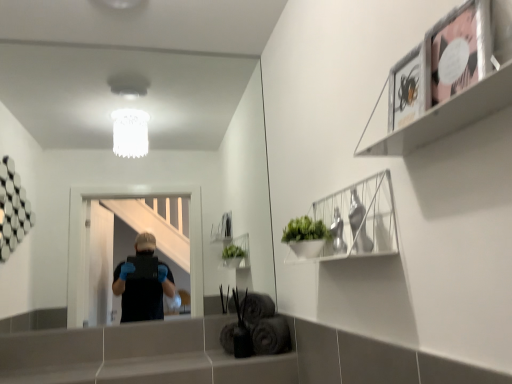
Question: Considering the relative positions of matte black picture frame at upper right and metallic silver frame at upper right in the image provided, is matte black picture frame at upper right in front of metallic silver frame at upper right?

Choices:
 (A) no
 (B) yes

Answer: (A)

Question: Could you tell me if matte black picture frame at upper right is facing metallic silver frame at upper right?

Choices:
 (A) no
 (B) yes

Answer: (B)

Question: Does matte black picture frame at upper right have a larger size compared to metallic silver frame at upper right?

Choices:
 (A) yes
 (B) no

Answer: (B)

Question: Can you confirm if matte black picture frame at upper right is smaller than metallic silver frame at upper right?

Choices:
 (A) yes
 (B) no

Answer: (A)

Question: Is the depth of matte black picture frame at upper right greater than that of metallic silver frame at upper right?

Choices:
 (A) no
 (B) yes

Answer: (B)

Question: From the image's perspective, is matte black picture frame at upper right above metallic silver frame at upper right?

Choices:
 (A) yes
 (B) no

Answer: (B)

Question: Considering the relative sizes of smooth gray ledge at lower center and metallic silver frame at upper right in the image provided, is smooth gray ledge at lower center thinner than metallic silver frame at upper right?

Choices:
 (A) yes
 (B) no

Answer: (B)

Question: Is smooth gray ledge at lower center positioned with its back to metallic silver frame at upper right?

Choices:
 (A) no
 (B) yes

Answer: (A)

Question: Considering the relative sizes of smooth gray ledge at lower center and metallic silver frame at upper right in the image provided, is smooth gray ledge at lower center wider than metallic silver frame at upper right?

Choices:
 (A) no
 (B) yes

Answer: (B)

Question: Does smooth gray ledge at lower center touch metallic silver frame at upper right?

Choices:
 (A) no
 (B) yes

Answer: (A)

Question: From a real-world perspective, is smooth gray ledge at lower center over metallic silver frame at upper right?

Choices:
 (A) no
 (B) yes

Answer: (A)

Question: Can you confirm if smooth gray ledge at lower center is positioned to the right of metallic silver frame at upper right?

Choices:
 (A) no
 (B) yes

Answer: (A)

Question: Is metallic silver frame at upper right at the left side of white wire basket at upper right?

Choices:
 (A) yes
 (B) no

Answer: (B)